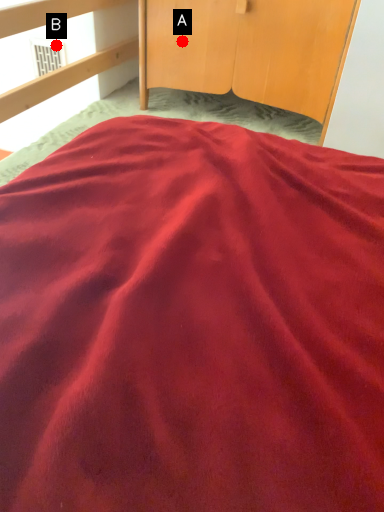
Question: Two points are circled on the image, labeled by A and B beside each circle. Which of the following is the closest to the observer?

Choices:
 (A) A is closer
 (B) B is closer

Answer: (A)